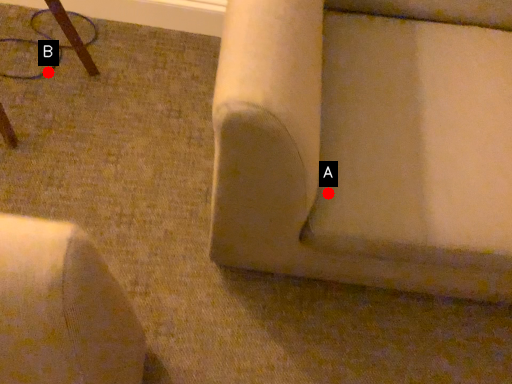
Question: Two points are circled on the image, labeled by A and B beside each circle. Which of the following is the closest to the observer?

Choices:
 (A) A is closer
 (B) B is closer

Answer: (A)